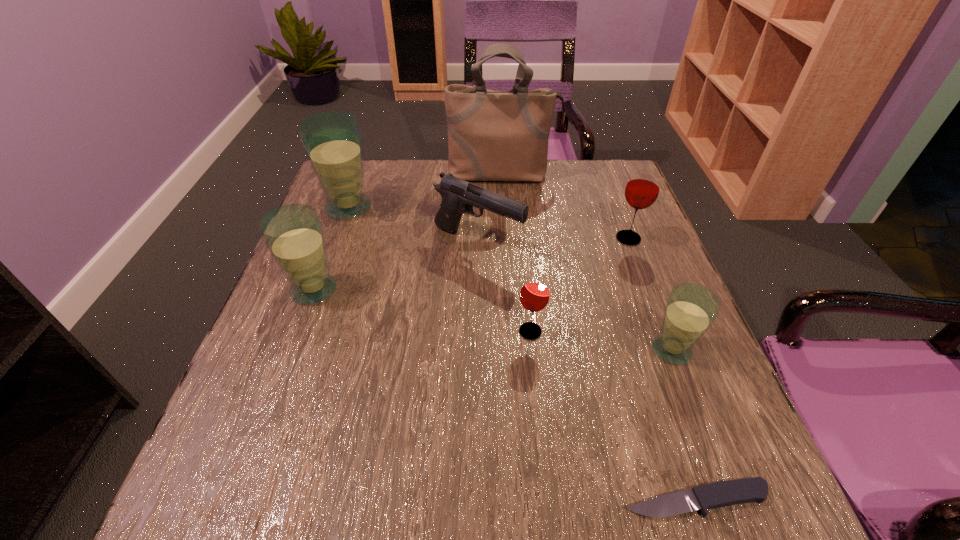
Locate an element on the screen. blue glass that can be found as the second closest to the fourth nearest glass is located at coordinates coord(332,140).